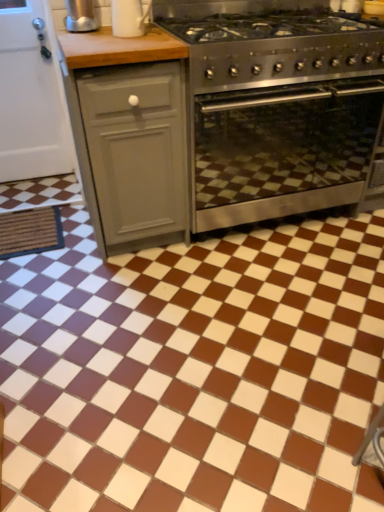
Identify the location of free space in front of gray matte cabinet at left. The image size is (384, 512). (127, 287).